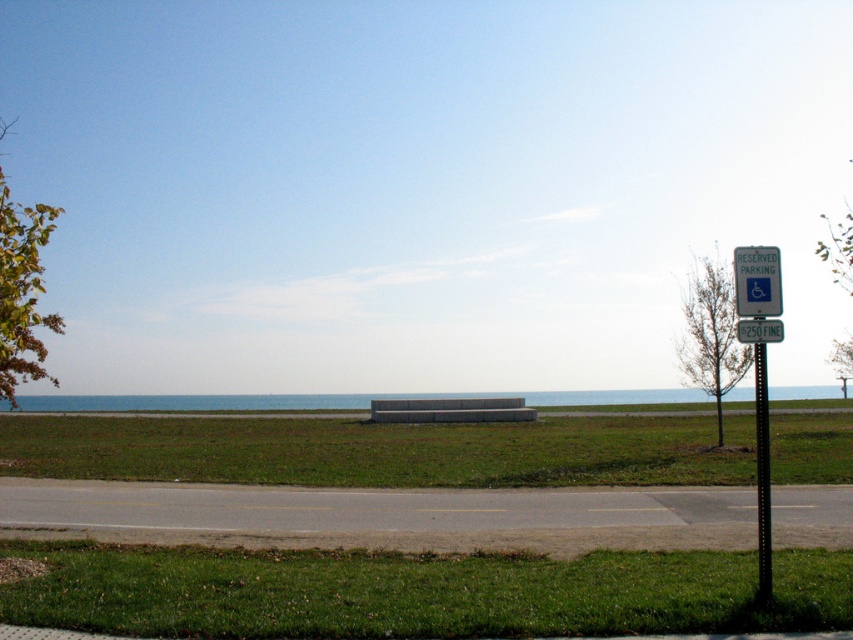
You are a person with a mobility impairment using a wheelchair. You need to park in the reserved area but want to ensure your wheelchair can reach the bench. The path between the green grass at lower center and the black metal pole at right is 1.2 meters wide. Your wheelchair has a width of 0.8 meters. Can you safely navigate to the bench?

The path between the green grass at lower center and the black metal pole at right is 1.2 meters wide. Since your wheelchair is 0.8 meters wide, there is enough space to navigate safely.

You are standing at the edge of the grassy area and want to walk to the green leafy tree at left. Which direction should you move relative to the green grass at center?

You should move towards the left side of the green grass at center to reach the green leafy tree at left because the tree is positioned to the left of the grass area.